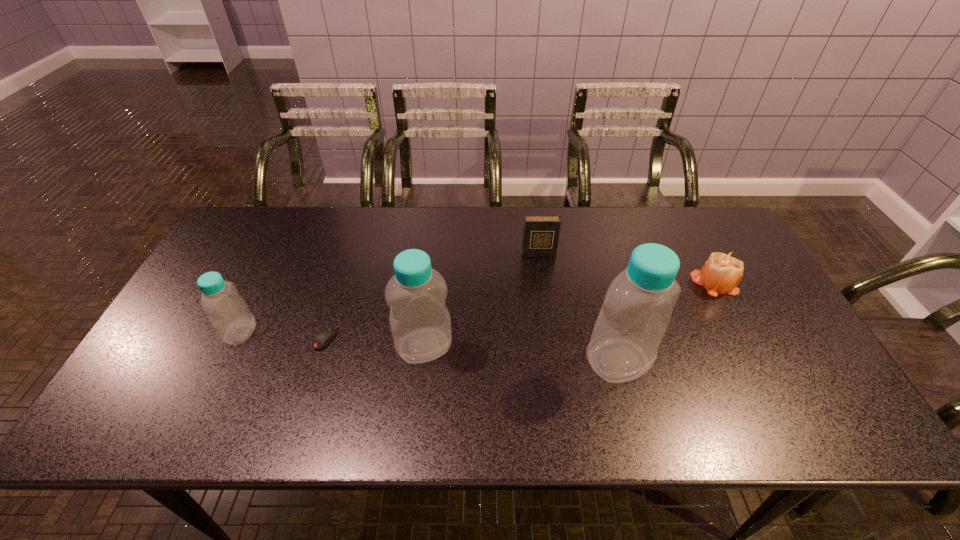
Find the location of a particular element. This screenshot has height=540, width=960. free space between the second tallest bottle and the rightmost object is located at coordinates (569, 314).

Locate an element on the screen. The image size is (960, 540). free space between the diary and the second shortest bottle is located at coordinates (481, 300).

At what (x,y) coordinates should I click in order to perform the action: click on object that is the second closest to the farthest object. Please return your answer as a coordinate pair (x, y). The image size is (960, 540). Looking at the image, I should click on (420, 323).

Find the location of `object that is the third closest to the leftmost bottle`. object that is the third closest to the leftmost bottle is located at coordinates click(x=541, y=233).

The image size is (960, 540). I want to click on bottle object that ranks as the second closest to the fourth object from left to right, so click(x=420, y=323).

Locate which bottle ranks third in proximity to the second object from left to right. Please provide its 2D coordinates. Your answer should be formatted as a tuple, i.e. [(x, y)], where the tuple contains the x and y coordinates of a point satisfying the conditions above.

[(637, 309)]

The height and width of the screenshot is (540, 960). Identify the location of free space in the image that satisfies the following two spatial constraints: 1. on the back side of the rightmost object; 2. on the right side of the second tallest bottle. (431, 283).

Where is `blank area in the image that satisfies the following two spatial constraints: 1. on the back side of the second object from left to right; 2. on the left side of the rightmost object`? The height and width of the screenshot is (540, 960). blank area in the image that satisfies the following two spatial constraints: 1. on the back side of the second object from left to right; 2. on the left side of the rightmost object is located at coordinates (343, 283).